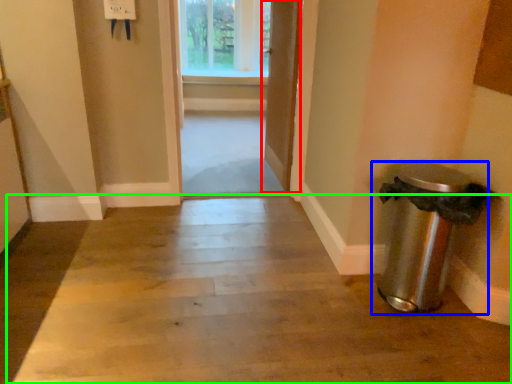
Question: Considering the real-world distances, which object is farthest from door (highlighted by a red box)? waste container (highlighted by a blue box) or path (highlighted by a green box)?

Choices:
 (A) waste container
 (B) path

Answer: (B)